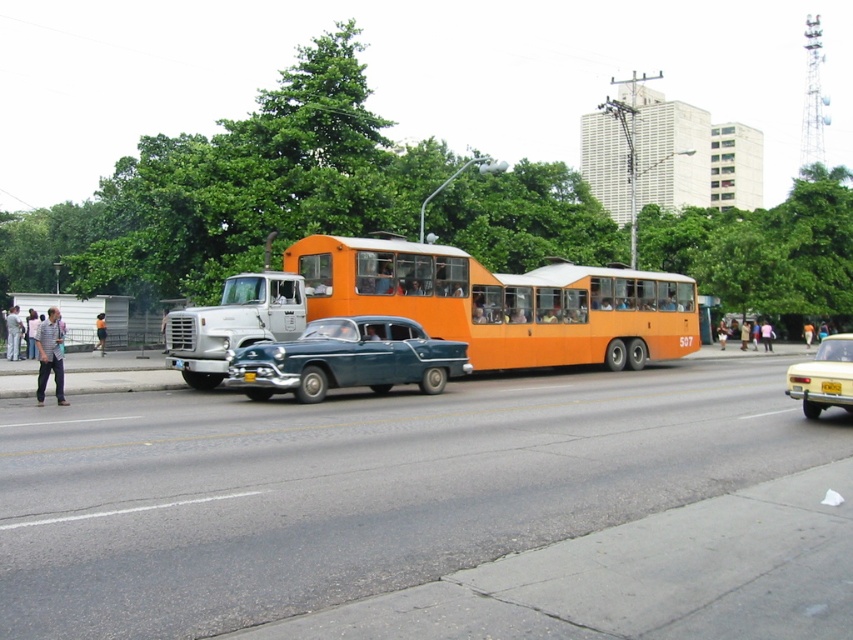
Can you confirm if metallic gold taxi at right is wider than yellow metallic license plate at center?

Yes, metallic gold taxi at right is wider than yellow metallic license plate at center.

At what (x,y) coordinates should I click in order to perform the action: click on metallic gold taxi at right. Please return your answer as a coordinate pair (x, y). Looking at the image, I should click on (822, 376).

Does orange matte bus at center appear on the left side of light blue jeans at left?

No, orange matte bus at center is not to the left of light blue jeans at left.

Can you confirm if orange matte bus at center is positioned below light blue jeans at left?

Actually, orange matte bus at center is above light blue jeans at left.

You are a GUI agent. You are given a task and a screenshot of the screen. Output one action in this format:
    pyautogui.click(x=<x>, y=<y>)
    Task: Click on the orange matte bus at center
    The image size is (853, 640).
    Given the screenshot: What is the action you would take?
    coord(502,301)

Which of these two, striped shirt at left or yellow metallic license plate at center, stands shorter?

With less height is yellow metallic license plate at center.

The width and height of the screenshot is (853, 640). What are the coordinates of `striped shirt at left` in the screenshot? It's located at (50, 355).

Between point (48, 349) and point (820, 385), which one is positioned in front?

Point (820, 385) is more forward.

Where is `striped shirt at left`? The width and height of the screenshot is (853, 640). striped shirt at left is located at coordinates (50, 355).